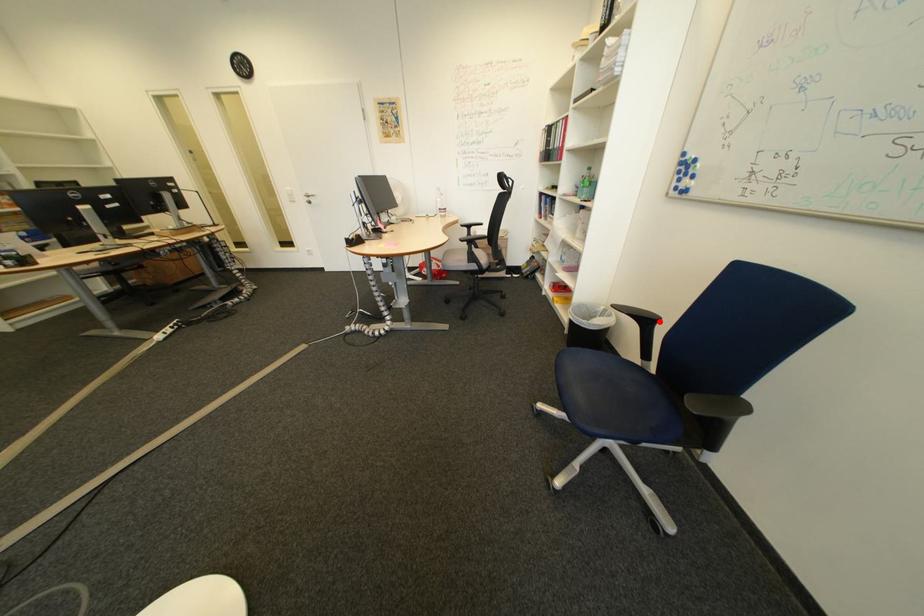
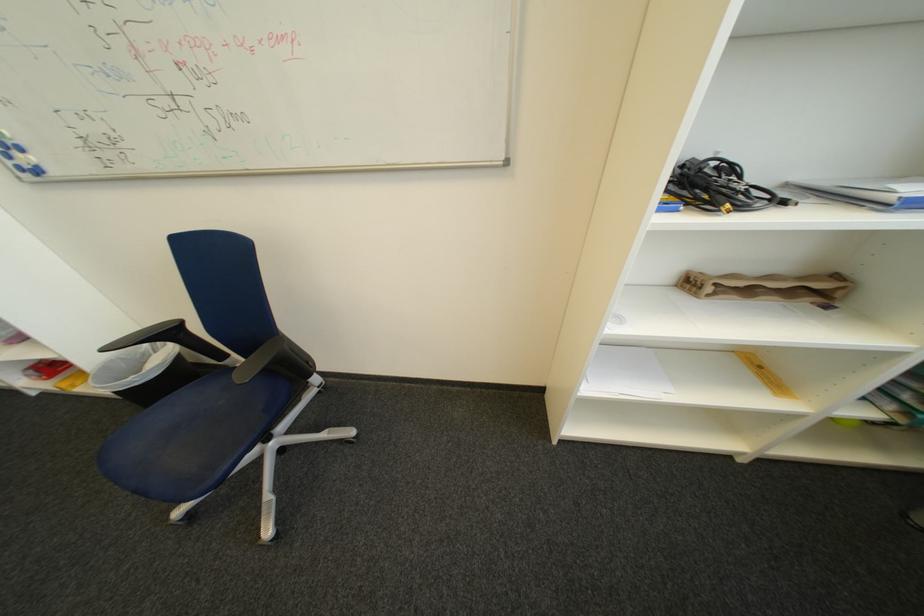
Locate, in the second image, the point that corresponds to the highlighted location in the first image.

(185, 334)